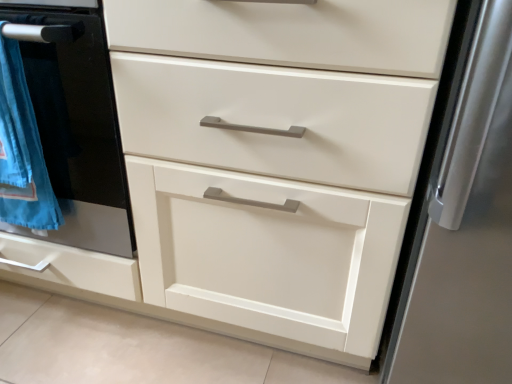
Question: Is blue cotton towel at left thinner than matte black oven at left?

Choices:
 (A) no
 (B) yes

Answer: (B)

Question: Is blue cotton towel at left completely or partially outside of matte black oven at left?

Choices:
 (A) no
 (B) yes

Answer: (A)

Question: Does blue cotton towel at left have a greater height compared to matte black oven at left?

Choices:
 (A) yes
 (B) no

Answer: (B)

Question: Is blue cotton towel at left smaller than matte black oven at left?

Choices:
 (A) yes
 (B) no

Answer: (A)

Question: Is blue cotton towel at left not close to matte black oven at left?

Choices:
 (A) yes
 (B) no

Answer: (B)

Question: Considering the relative positions of blue cotton towel at left and matte black oven at left in the image provided, is blue cotton towel at left to the left of matte black oven at left from the viewer's perspective?

Choices:
 (A) yes
 (B) no

Answer: (A)

Question: Considering the relative positions of matte black oven at left and blue cotton towel at left in the image provided, is matte black oven at left to the right of blue cotton towel at left from the viewer's perspective?

Choices:
 (A) yes
 (B) no

Answer: (A)

Question: Is matte black oven at left directly adjacent to blue cotton towel at left?

Choices:
 (A) no
 (B) yes

Answer: (B)

Question: Considering the relative sizes of matte black oven at left and blue cotton towel at left in the image provided, is matte black oven at left smaller than blue cotton towel at left?

Choices:
 (A) no
 (B) yes

Answer: (A)

Question: Would you consider matte black oven at left to be distant from blue cotton towel at left?

Choices:
 (A) no
 (B) yes

Answer: (A)

Question: Considering the relative positions of matte black oven at left and blue cotton towel at left in the image provided, is matte black oven at left to the left of blue cotton towel at left from the viewer's perspective?

Choices:
 (A) yes
 (B) no

Answer: (B)

Question: From a real-world perspective, is matte black oven at left beneath blue cotton towel at left?

Choices:
 (A) no
 (B) yes

Answer: (B)

Question: In terms of width, does blue cotton towel at left look wider or thinner when compared to matte black oven at left?

Choices:
 (A) thin
 (B) wide

Answer: (A)